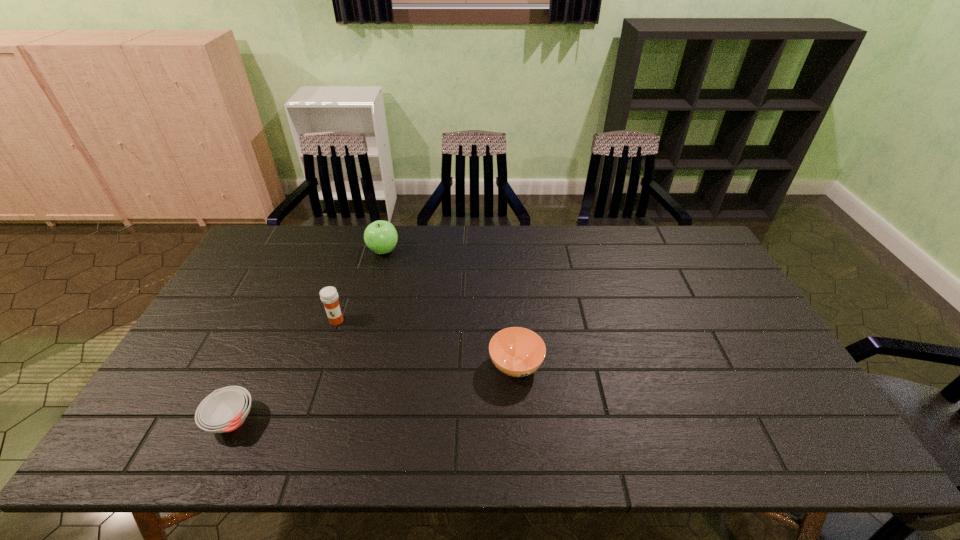
At what (x,y) coordinates should I click in order to perform the action: click on blank area located on the left of the taller soup bowl. Please return your answer as a coordinate pair (x, y). Looking at the image, I should click on (406, 366).

The width and height of the screenshot is (960, 540). I want to click on blank space located on the right of the shorter soup bowl, so click(395, 420).

Find the location of a particular element. object that is at the far edge is located at coordinates 381,237.

The width and height of the screenshot is (960, 540). In order to click on object located at the near edge in this screenshot , I will do `click(224, 410)`.

Identify the location of object positioned at the left edge. (224, 410).

What are the coordinates of `object that is at the near left corner` in the screenshot? It's located at (224, 410).

In order to click on free space at the far edge in this screenshot , I will do `click(516, 242)`.

Locate an element on the screen. The image size is (960, 540). free location at the near edge of the desktop is located at coordinates (219, 458).

Locate an element on the screen. The image size is (960, 540). free space at the far left corner of the desktop is located at coordinates (279, 239).

I want to click on free space between the second farthest object and the third object from left to right, so click(360, 286).